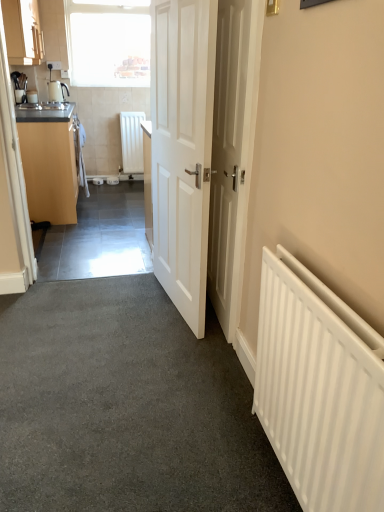
Question: Is white matte door at center, the second door in the left-to-right sequence, smaller than white matte radiator at right, the 1th radiator in the bottom-to-top sequence?

Choices:
 (A) no
 (B) yes

Answer: (B)

Question: Is white matte door at center, which is the first door in right-to-left order, wider than white matte radiator at right, the 1th radiator in the bottom-to-top sequence?

Choices:
 (A) yes
 (B) no

Answer: (B)

Question: Considering the relative sizes of white matte door at center, which is the first door in right-to-left order, and white matte radiator at right, placed as the first radiator when sorted from front to back, in the image provided, is white matte door at center, which is the first door in right-to-left order, taller than white matte radiator at right, placed as the first radiator when sorted from front to back,?

Choices:
 (A) no
 (B) yes

Answer: (B)

Question: Is white matte door at center, which is the first door in right-to-left order, in front of white matte radiator at right, the second radiator from the top?

Choices:
 (A) no
 (B) yes

Answer: (A)

Question: From a real-world perspective, is white matte door at center, which is the first door in right-to-left order, on white matte radiator at right, which appears as the first radiator when viewed from the right?

Choices:
 (A) no
 (B) yes

Answer: (B)

Question: From the image's perspective, is white matte door at center, which is the first door in right-to-left order, above or below matte black kettle at left?

Choices:
 (A) above
 (B) below

Answer: (B)

Question: Considering their positions, is white matte door at center, the second door in the left-to-right sequence, located in front of or behind matte black kettle at left?

Choices:
 (A) front
 (B) behind

Answer: (A)

Question: From their relative heights in the image, would you say white matte door at center, which is the first door in right-to-left order, is taller or shorter than matte black kettle at left?

Choices:
 (A) short
 (B) tall

Answer: (B)

Question: From a real-world perspective, is white matte door at center, which is the first door in right-to-left order, positioned above or below matte black kettle at left?

Choices:
 (A) above
 (B) below

Answer: (B)

Question: From a real-world perspective, relative to white matte radiator at center, which is the first radiator in back-to-front order, is white matte radiator at right, the second radiator viewed from the back, vertically above or below?

Choices:
 (A) below
 (B) above

Answer: (A)

Question: Would you say white matte radiator at right, which appears as the first radiator when viewed from the right, is to the left or to the right of white matte radiator at center, the first radiator in the left-to-right sequence, in the picture?

Choices:
 (A) right
 (B) left

Answer: (A)

Question: Is point (357, 424) positioned closer to the camera than point (120, 145)?

Choices:
 (A) farther
 (B) closer

Answer: (B)

Question: From the image's perspective, relative to white matte radiator at center, the first radiator in the left-to-right sequence, is white matte radiator at right, the second radiator viewed from the back, above or below?

Choices:
 (A) below
 (B) above

Answer: (A)

Question: Is point [36, 36] closer or farther from the camera than point [96, 15]?

Choices:
 (A) closer
 (B) farther

Answer: (A)

Question: Is matte wood cabinet at upper left, which is the first cabinetry from top to bottom, bigger or smaller than transparent glass window at upper left?

Choices:
 (A) big
 (B) small

Answer: (A)